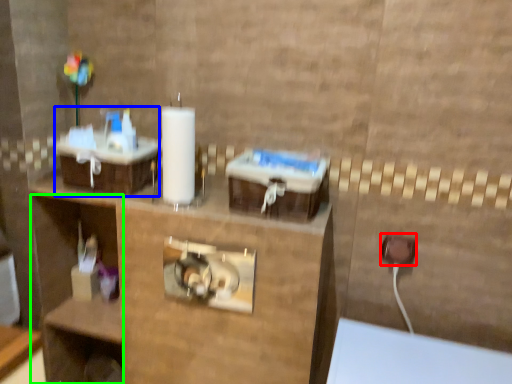
Question: Which object is positioned farthest from electric outlet (highlighted by a red box)? Select from sink (highlighted by a blue box) and shelf (highlighted by a green box).

Choices:
 (A) sink
 (B) shelf

Answer: (B)